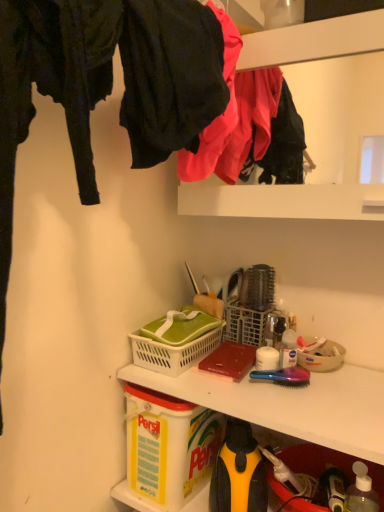
The image size is (384, 512). I want to click on vacant region to the left of white plastic bottle at center, the 2th bottle in the right-to-left sequence, so click(x=224, y=387).